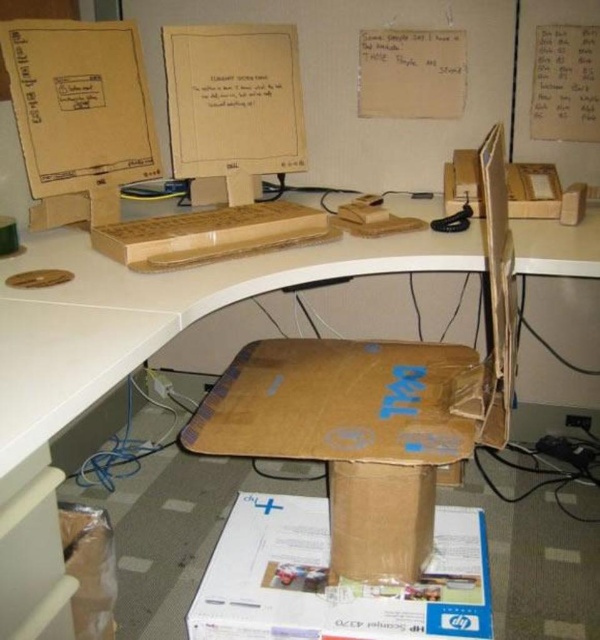
Is white cardboard computer monitor at upper center below white paper at upper right?

Correct, white cardboard computer monitor at upper center is located below white paper at upper right.

Can you confirm if white cardboard computer monitor at upper center is positioned to the left of white paper at upper right?

Yes, white cardboard computer monitor at upper center is to the left of white paper at upper right.

At what (x,y) coordinates should I click in order to perform the action: click on white cardboard computer monitor at upper center. Please return your answer as a coordinate pair (x, y). Image resolution: width=600 pixels, height=640 pixels. Looking at the image, I should click on (232, 106).

This screenshot has height=640, width=600. Find the location of `white cardboard computer monitor at upper center`. white cardboard computer monitor at upper center is located at coordinates (232, 106).

Does brown cardboard computer desk at center come in front of white cardboard computer monitor at upper center?

Yes, it is.

The width and height of the screenshot is (600, 640). What are the coordinates of `brown cardboard computer desk at center` in the screenshot? It's located at (148, 320).

The height and width of the screenshot is (640, 600). I want to click on brown cardboard computer desk at center, so click(x=148, y=320).

Is brown cardboard computer desk at center smaller than brown cardboard box at center?

No, brown cardboard computer desk at center is not smaller than brown cardboard box at center.

Is brown cardboard computer desk at center closer to the viewer compared to brown cardboard box at center?

Yes, brown cardboard computer desk at center is in front of brown cardboard box at center.

The height and width of the screenshot is (640, 600). What are the coordinates of `brown cardboard computer desk at center` in the screenshot? It's located at (148, 320).